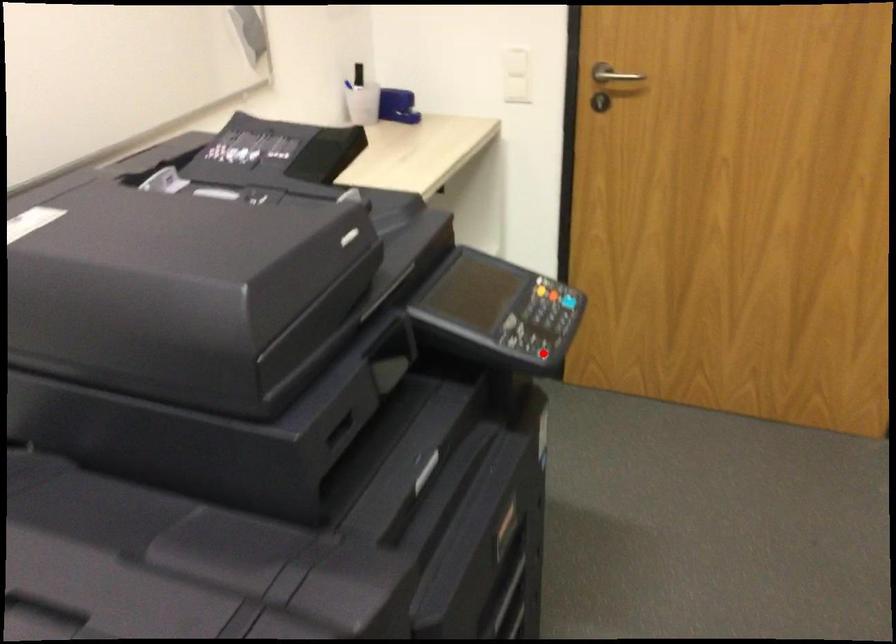
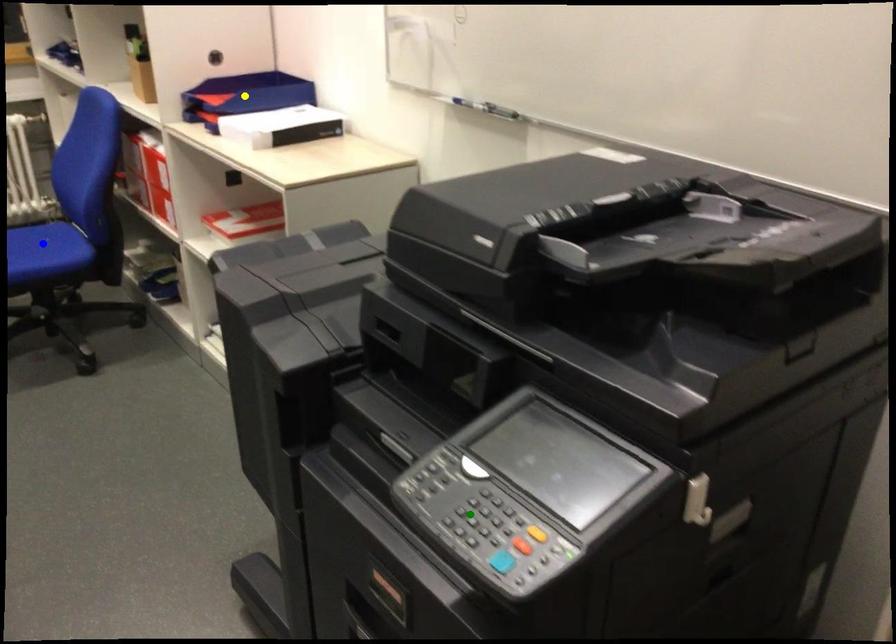
Question: I am providing you with two images of the same scene from different viewpoints. A red point is marked on the first image. You are given multiple points on the second image. Which mark in image 2 goes with the point in image 1?

Choices:
 (A) blue point
 (B) green point
 (C) yellow point

Answer: (B)